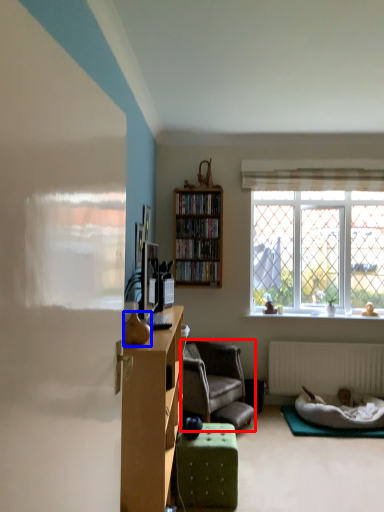
Question: Which point is further to the camera, chair (highlighted by a red box) or vase (highlighted by a blue box)?

Choices:
 (A) chair
 (B) vase

Answer: (A)